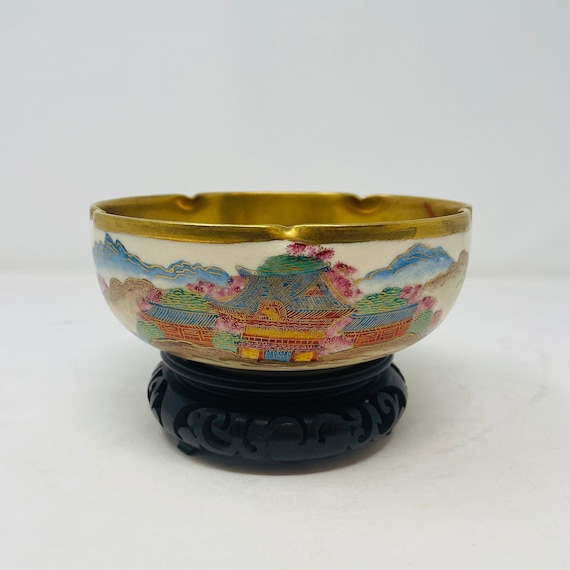
Locate an element on the screen. black bottom of bowl is located at coordinates (174, 398), (271, 414), (376, 394).